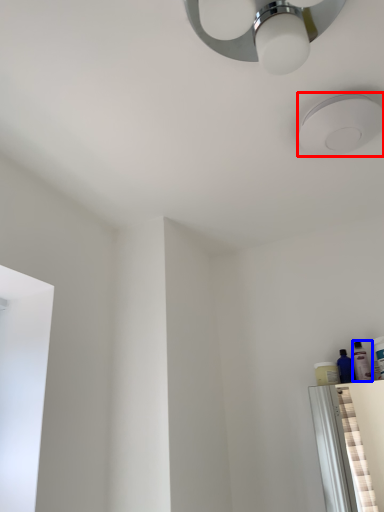
Question: Which point is closer to the camera, droplight (highlighted by a red box) or toiletry (highlighted by a blue box)?

Choices:
 (A) droplight
 (B) toiletry

Answer: (A)